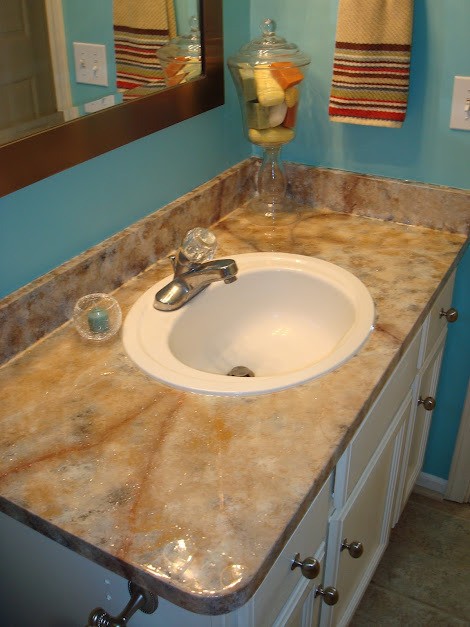
Locate an element on the screen. Image resolution: width=470 pixels, height=627 pixels. sink is located at coordinates click(x=237, y=525).